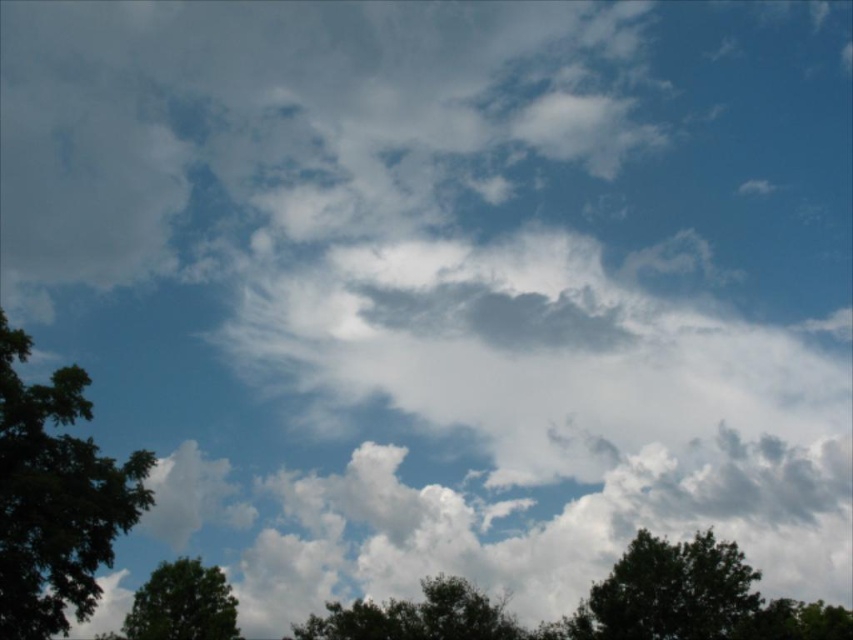
You are standing in a forest and want to find the tallest tree between the dark green leafy tree at lower right and the green leafy tree at center. Which one should you look for?

The green leafy tree at center is taller than the dark green leafy tree at lower right, so you should look for the green leafy tree at center.

You are standing in a forest looking up at the sky. You notice a green leafy tree at left. Where is the green leafy tree at left located relative to the point marked at point coordinates (55, 497)?

The green leafy tree at left is located at point coordinates (55, 497).